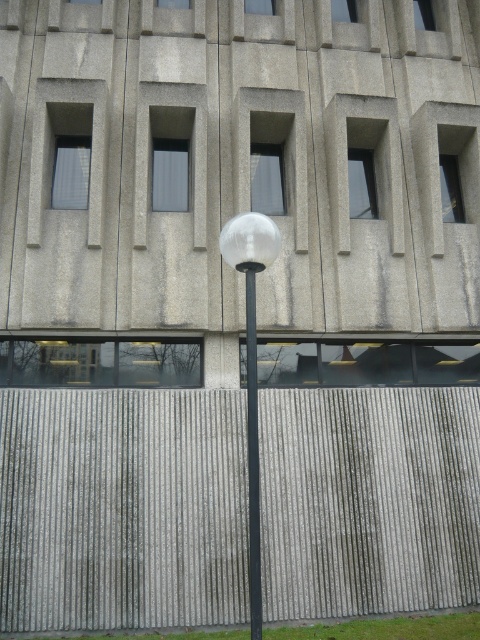
Question: Which point is farther from the camera taking this photo?

Choices:
 (A) (261, 625)
 (B) (276, 253)

Answer: (B)

Question: Which object is closer to the camera taking this photo?

Choices:
 (A) transparent glass street light at center
 (B) polished glass pole at center

Answer: (A)

Question: Considering the relative positions of transparent glass street light at center and polished glass pole at center in the image provided, where is transparent glass street light at center located with respect to polished glass pole at center?

Choices:
 (A) above
 (B) below

Answer: (A)

Question: Can you confirm if transparent glass street light at center is positioned above polished glass pole at center?

Choices:
 (A) yes
 (B) no

Answer: (A)

Question: Which point is closer to the camera?

Choices:
 (A) (253, 445)
 (B) (264, 266)

Answer: (B)

Question: Is transparent glass street light at center to the right of polished glass pole at center from the viewer's perspective?

Choices:
 (A) yes
 (B) no

Answer: (B)